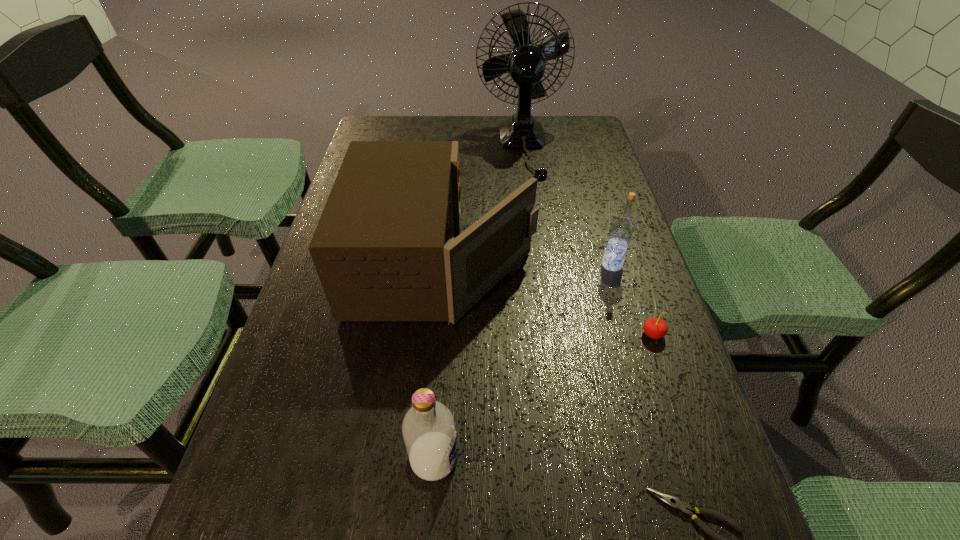
You are a GUI agent. You are given a task and a screenshot of the screen. Output one action in this format:
    pyautogui.click(x=<x>, y=<y>)
    Task: Click on the tallest object
    This screenshot has width=960, height=540.
    Given the screenshot: What is the action you would take?
    pyautogui.click(x=526, y=65)

Where is `fan`? This screenshot has width=960, height=540. fan is located at coordinates tap(526, 65).

Locate an element on the screen. microwave oven is located at coordinates (384, 249).

This screenshot has height=540, width=960. I want to click on the right vodka, so click(622, 228).

Identify the location of the second nearest object. (429, 431).

Where is `the nearer vodka`? Image resolution: width=960 pixels, height=540 pixels. the nearer vodka is located at coordinates (x=429, y=431).

The image size is (960, 540). What are the coordinates of `the fifth tallest object` in the screenshot? It's located at (655, 328).

Identify the location of free location located in front of the farthest object, indicating the direction of air flow. (541, 282).

In order to click on vacant space located with the door open on the front of the microwave oven in this screenshot , I will do `click(582, 263)`.

Locate an element on the screen. This screenshot has height=540, width=960. free location located 0.190m on the left of the farther vodka is located at coordinates (518, 265).